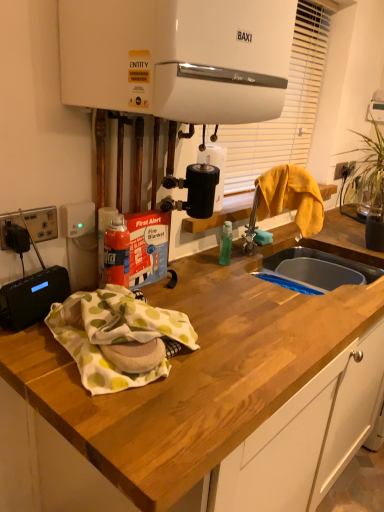
Locate an element on the screen. green leafy plant at right is located at coordinates (364, 175).

The height and width of the screenshot is (512, 384). What do you see at coordinates (178, 57) in the screenshot?
I see `white glossy boiler at upper center` at bounding box center [178, 57].

What is the approximate height of black plastic socket at left?

The height of black plastic socket at left is 3.64 inches.

What is the approximate width of yellow fabric at sink?

It is 23.54 centimeters.

Image resolution: width=384 pixels, height=512 pixels. What do you see at coordinates (283, 108) in the screenshot?
I see `white plastic blind at upper center` at bounding box center [283, 108].

What do you see at coordinates (200, 403) in the screenshot? Image resolution: width=384 pixels, height=512 pixels. I see `wooden at center` at bounding box center [200, 403].

Find the location of `green leafy plant at right`. green leafy plant at right is located at coordinates (364, 175).

Considering the positions of objects white glossy boiler at upper center and wooden at center in the image provided, who is more to the right, white glossy boiler at upper center or wooden at center?

wooden at center is more to the right.

From a real-world perspective, which object stands above the other?

white glossy boiler at upper center is physically above.

From the picture: Is white glossy boiler at upper center in front of or behind wooden at center in the image?

white glossy boiler at upper center is positioned farther from the viewer than wooden at center.

Does white glossy boiler at upper center touch wooden at center?

No.

Can you confirm if black plastic socket at left is positioned to the right of yellow fabric at sink?

In fact, black plastic socket at left is to the left of yellow fabric at sink.

From a real-world perspective, is black plastic socket at left located higher than yellow fabric at sink?

Incorrect, from a real-world perspective, black plastic socket at left is lower than yellow fabric at sink.

Consider the image. Which point is more distant from viewer, (0,227) or (318,226)?

The point (318,226) is farther.

Locate an element on the screen. The height and width of the screenshot is (512, 384). clothe that appears behind the black plastic socket at left is located at coordinates point(291,197).

Considering the relative sizes of white glossy boiler at upper center and black plastic socket at left in the image provided, is white glossy boiler at upper center taller than black plastic socket at left?

Yes, white glossy boiler at upper center is taller than black plastic socket at left.

Considering the positions of objects white glossy boiler at upper center and black plastic socket at left in the image provided, who is more to the right, white glossy boiler at upper center or black plastic socket at left?

From the viewer's perspective, white glossy boiler at upper center appears more on the right side.

Is black plastic socket at left a part of white glossy boiler at upper center?

That's incorrect, black plastic socket at left is not inside white glossy boiler at upper center.

Considering the positions of points (348, 168) and (46, 231), is point (348, 168) farther from camera compared to point (46, 231)?

Yes, it is behind point (46, 231).

Between green leafy plant at right and black plastic socket at left, which one has larger width?

With larger width is green leafy plant at right.

Can you tell me how much green leafy plant at right and black plastic socket at left differ in facing direction?

The angle between the facing direction of green leafy plant at right and the facing direction of black plastic socket at left is 0.00114 degrees.

Is green leafy plant at right positioned far away from black plastic socket at left?

Indeed, green leafy plant at right is not near black plastic socket at left.

At what (x,y) coordinates should I click in order to perform the action: click on home appliance in front of the white plastic blind at upper center. Please return your answer as a coordinate pair (x, y). The height and width of the screenshot is (512, 384). Looking at the image, I should click on (178, 57).

Based on the photo, from the image's perspective, is white plastic blind at upper center below white glossy boiler at upper center?

Incorrect, from the image's perspective, white plastic blind at upper center is higher than white glossy boiler at upper center.

How distant is white plastic blind at upper center from white glossy boiler at upper center?

white plastic blind at upper center and white glossy boiler at upper center are 30.36 inches apart from each other.

Considering the sizes of white plastic blind at upper center and white glossy boiler at upper center in the image, is white plastic blind at upper center wider or thinner than white glossy boiler at upper center?

Considering their sizes, white plastic blind at upper center looks slimmer than white glossy boiler at upper center.

Is white plastic blind at upper center facing away from green leafy plant at right?

No, white plastic blind at upper center is not facing the opposite direction of green leafy plant at right.

From the image's perspective, is white plastic blind at upper center on top of green leafy plant at right?

Yes, from the image's perspective, white plastic blind at upper center is on top of green leafy plant at right.

Considering the positions of points (285, 151) and (382, 162), is point (285, 151) closer to camera compared to point (382, 162)?

No, it is behind (382, 162).

From the image's perspective, is wooden at center beneath black plastic socket at left?

Yes.

How different are the orientations of wooden at center and black plastic socket at left in degrees?

The facing directions of wooden at center and black plastic socket at left are 0.00125 degrees apart.

Is wooden at center turned away from black plastic socket at left?

No.

Does wooden at center contain black plastic socket at left?

Actually, black plastic socket at left is outside wooden at center.

At what (x,y) coordinates should I click in order to perform the action: click on countertop located underneath the white glossy boiler at upper center (from a real-world perspective). Please return your answer as a coordinate pair (x, y). The height and width of the screenshot is (512, 384). Looking at the image, I should click on (200, 403).

Identify the location of electric outlet located below the yellow fabric at sink (from the image's perspective). (42, 223).

From the image, which object appears to be farther from green leafy plant at right, yellow fabric at sink or wooden at center?

Based on the image, wooden at center appears to be further to green leafy plant at right.

Considering their positions, is green leafy plant at right positioned further to white plastic blind at upper center than yellow fabric at sink?

green leafy plant at right is positioned further to the anchor white plastic blind at upper center.

When comparing their distances from green leafy plant at right, does wooden at center or yellow fabric at sink seem closer?

yellow fabric at sink lies closer to green leafy plant at right than the other object.

From the image, which object appears to be nearer to black plastic socket at left, white plastic blind at upper center or white glossy boiler at upper center?

Based on the image, white glossy boiler at upper center appears to be nearer to black plastic socket at left.

Considering their positions, is wooden at center positioned further to white glossy boiler at upper center than black plastic socket at left?

wooden at center.

When comparing their distances from white glossy boiler at upper center, does black plastic socket at left or green leafy plant at right seem closer?

→ black plastic socket at left.

Based on their spatial positions, is white plastic blind at upper center or wooden at center closer to yellow fabric at sink?

white plastic blind at upper center lies closer to yellow fabric at sink than the other object.

Based on their spatial positions, is white glossy boiler at upper center or green leafy plant at right further from white plastic blind at upper center?

white glossy boiler at upper center.

I want to click on clothe between black plastic socket at left and green leafy plant at right, so click(291, 197).

The image size is (384, 512). In order to click on clothe between black plastic socket at left and wooden at center in this screenshot , I will do `click(291, 197)`.

Identify the location of electric outlet between white plastic blind at upper center and wooden at center in the vertical direction. (42, 223).

Identify the location of plant between white glossy boiler at upper center and wooden at center in the vertical direction. (364, 175).